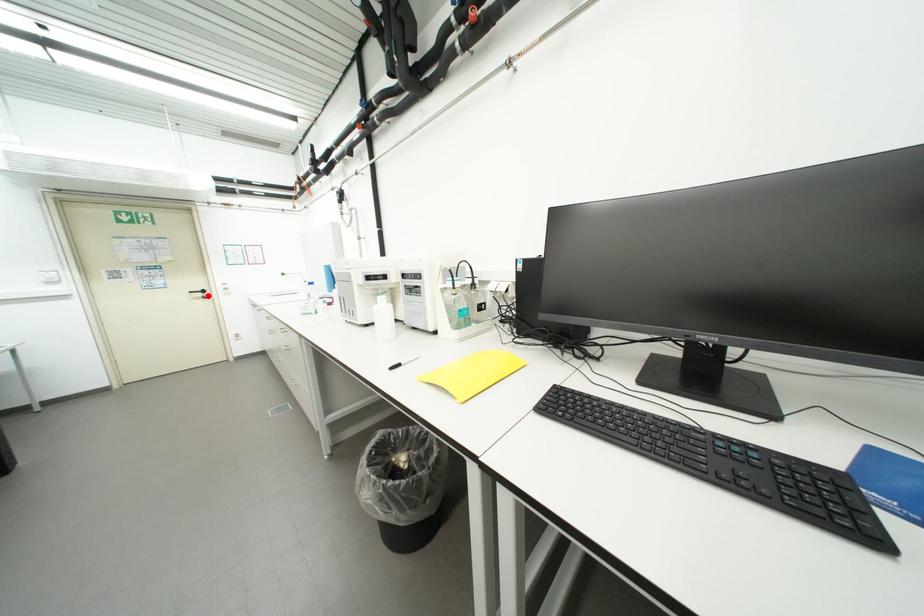
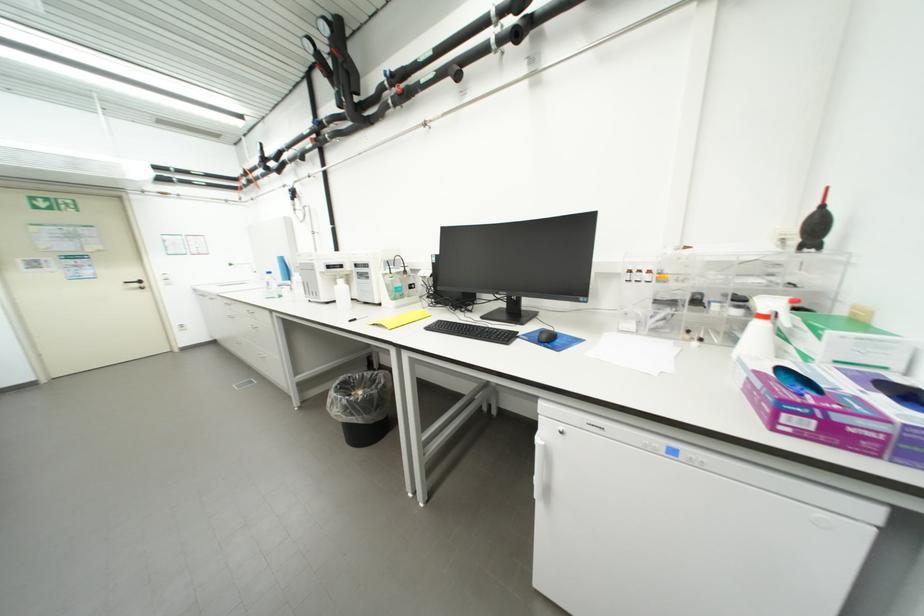
In the second image, find the point that corresponds to the highlighted location in the first image.

(144, 286)